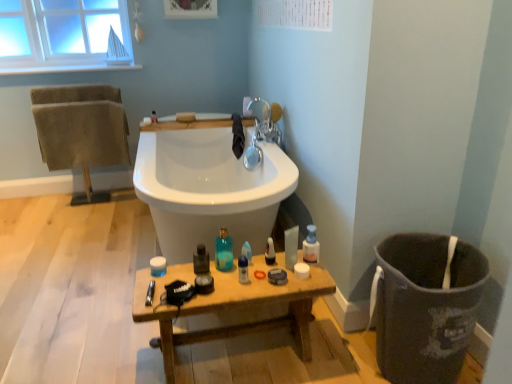
In order to click on free location to the right of translucent plastic container at center, which is counted as the 4th toiletry, starting from the top in this screenshot , I will do `click(202, 276)`.